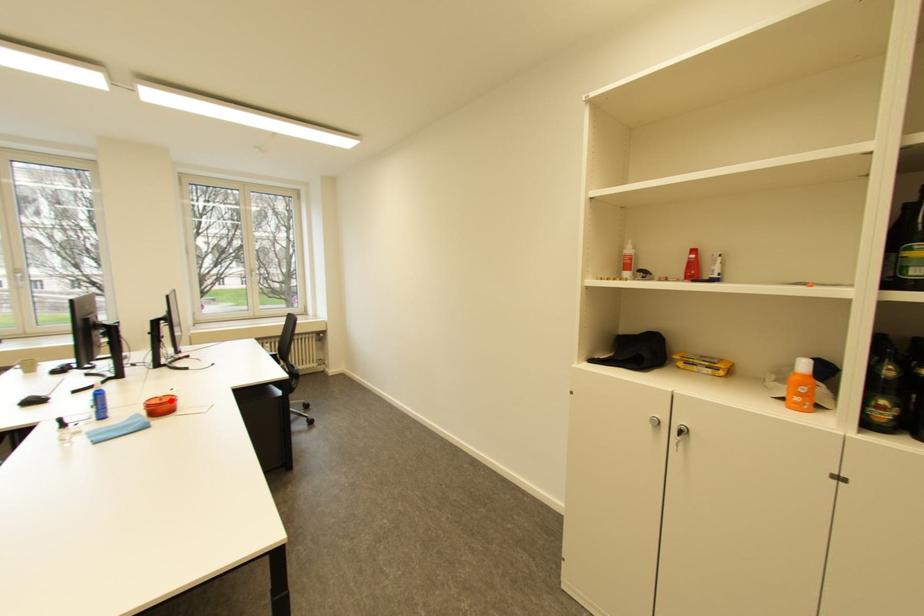
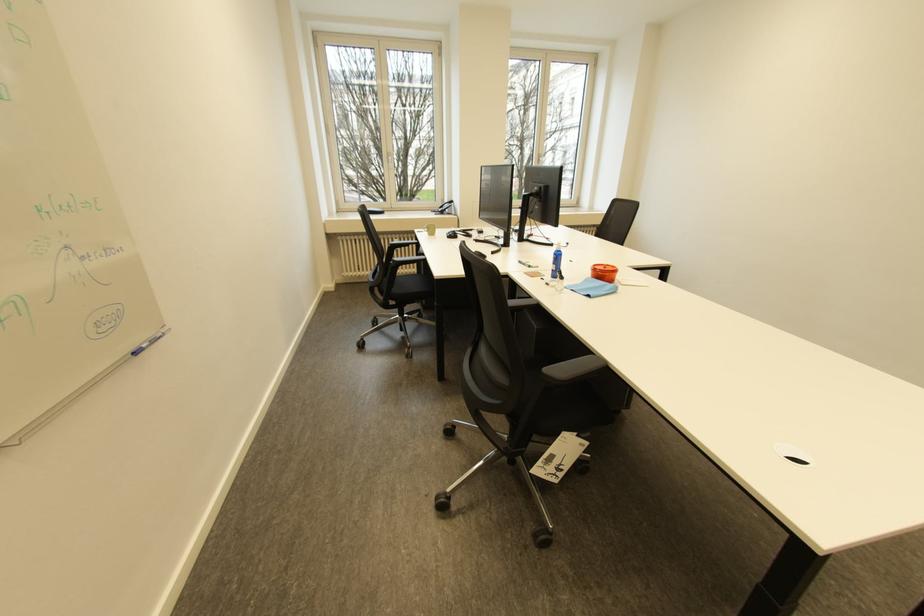
In the second image, find the point that corresponds to the highlighted location in the first image.

(614, 268)